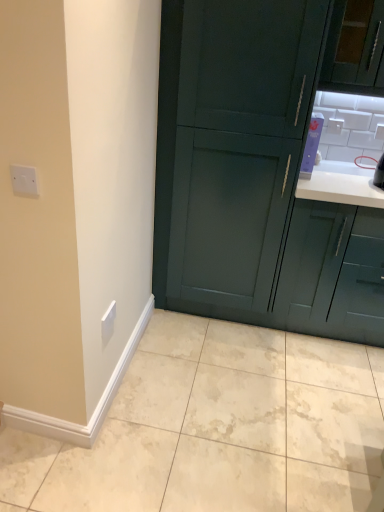
You are a GUI agent. You are given a task and a screenshot of the screen. Output one action in this format:
    pyautogui.click(x=<x>, y=<y>)
    Task: Click on the white plastic electric outlet at upper right, which appears as the 3th electric outlet when ordered from the bottom
    This screenshot has height=512, width=384.
    Given the screenshot: What is the action you would take?
    pyautogui.click(x=379, y=131)

The height and width of the screenshot is (512, 384). Describe the element at coordinates (379, 131) in the screenshot. I see `white plastic electric outlet at upper right, which ranks as the second electric outlet in top-to-bottom order` at that location.

Consider the image. How much space does dark green wood cabinet at center, which appears as the first cabinetry when viewed from the left, occupy horizontally?

It is 63.85 centimeters.

I want to click on white plastic electric outlet at upper left, which ranks as the 2th electric outlet in bottom-to-top order, so click(x=24, y=180).

Measure the distance between point (27, 195) and camera.

The depth of point (27, 195) is 4.29 feet.

Where is `white plastic electric outlet at upper right, the first electric outlet positioned from the right`? The height and width of the screenshot is (512, 384). white plastic electric outlet at upper right, the first electric outlet positioned from the right is located at coordinates (379, 131).

How much distance is there between matte teal cabinet at upper right, the second cabinetry in the left-to-right sequence, and dark green wood cabinet at center, placed as the 2th cabinetry when sorted from right to left?

They are 9.07 inches apart.

Which of these two, matte teal cabinet at upper right, the second cabinetry in the left-to-right sequence, or dark green wood cabinet at center, which appears as the first cabinetry when viewed from the left, is bigger?

Bigger between the two is dark green wood cabinet at center, which appears as the first cabinetry when viewed from the left.

Is matte teal cabinet at upper right, which ranks as the 1th cabinetry in right-to-left order, not within dark green wood cabinet at center, placed as the 2th cabinetry when sorted from right to left?

Yes, matte teal cabinet at upper right, which ranks as the 1th cabinetry in right-to-left order, is not within dark green wood cabinet at center, placed as the 2th cabinetry when sorted from right to left.

Is matte teal cabinet at upper right, the second cabinetry in the left-to-right sequence, oriented away from dark green wood cabinet at center, placed as the 2th cabinetry when sorted from right to left?

No.

Relative to matte teal cabinet at upper right, the second cabinetry in the left-to-right sequence, is white plastic electric outlet at upper left, which is counted as the 4th electric outlet, starting from the back, in front or behind?

Visually, white plastic electric outlet at upper left, which is counted as the 4th electric outlet, starting from the back, is located in front of matte teal cabinet at upper right, the second cabinetry in the left-to-right sequence.

Considering the positions of points (12, 174) and (345, 245), is point (12, 174) closer to camera compared to point (345, 245)?

Yes, point (12, 174) is closer to viewer.

Is white plastic electric outlet at upper left, acting as the 1th electric outlet starting from the front, wider than matte teal cabinet at upper right, the second cabinetry in the left-to-right sequence?

In fact, white plastic electric outlet at upper left, acting as the 1th electric outlet starting from the front, might be narrower than matte teal cabinet at upper right, the second cabinetry in the left-to-right sequence.

Is matte teal cabinet at upper right, the second cabinetry in the left-to-right sequence, looking in the opposite direction of white glossy electric outlet at upper center, which is the second electric outlet from right to left?

No, matte teal cabinet at upper right, the second cabinetry in the left-to-right sequence,'s orientation is not away from white glossy electric outlet at upper center, which is the second electric outlet from right to left.

Between matte teal cabinet at upper right, the second cabinetry in the left-to-right sequence, and white glossy electric outlet at upper center, marked as the fourth electric outlet in a bottom-to-top arrangement, which one has smaller size?

With smaller size is white glossy electric outlet at upper center, marked as the fourth electric outlet in a bottom-to-top arrangement.

Would you say matte teal cabinet at upper right, which ranks as the 1th cabinetry in right-to-left order, is outside white glossy electric outlet at upper center, the 1th electric outlet from the back?

Yes, matte teal cabinet at upper right, which ranks as the 1th cabinetry in right-to-left order, is located beyond the bounds of white glossy electric outlet at upper center, the 1th electric outlet from the back.

Considering the positions of objects matte teal cabinet at upper right, the second cabinetry in the left-to-right sequence, and white glossy electric outlet at upper center, marked as the 1th electric outlet in a top-to-bottom arrangement, in the image provided, who is in front, matte teal cabinet at upper right, the second cabinetry in the left-to-right sequence, or white glossy electric outlet at upper center, marked as the 1th electric outlet in a top-to-bottom arrangement,?

matte teal cabinet at upper right, the second cabinetry in the left-to-right sequence.

Is point (382, 134) closer to viewer compared to point (299, 206)?

No, (382, 134) is behind (299, 206).

Can you tell me how much white plastic electric outlet at upper right, which is the 3th electric outlet in front-to-back order, and matte teal cabinet at upper right, which ranks as the 1th cabinetry in right-to-left order, differ in facing direction?

1.83 degrees.

Are white plastic electric outlet at upper right, the first electric outlet positioned from the right, and matte teal cabinet at upper right, the second cabinetry in the left-to-right sequence, far apart?

No, white plastic electric outlet at upper right, the first electric outlet positioned from the right, is not far away from matte teal cabinet at upper right, the second cabinetry in the left-to-right sequence.

From the image's perspective, is white plastic electric outlet at upper right, which appears as the 4th electric outlet when viewed from the left, located beneath matte teal cabinet at upper right, the second cabinetry in the left-to-right sequence?

Incorrect, from the image's perspective, white plastic electric outlet at upper right, which appears as the 4th electric outlet when viewed from the left, is higher than matte teal cabinet at upper right, the second cabinetry in the left-to-right sequence.

Is white plastic electric outlet at upper right, which appears as the second electric outlet when viewed from the back, oriented away from white plastic electric outlet at upper left, arranged as the first electric outlet when viewed from the left?

white plastic electric outlet at upper right, which appears as the second electric outlet when viewed from the back, is not turned away from white plastic electric outlet at upper left, arranged as the first electric outlet when viewed from the left.

Is white plastic electric outlet at upper right, which is the 3th electric outlet in front-to-back order, taller or shorter than white plastic electric outlet at upper left, which is counted as the 4th electric outlet, starting from the back?

Considering their sizes, white plastic electric outlet at upper right, which is the 3th electric outlet in front-to-back order, has more height than white plastic electric outlet at upper left, which is counted as the 4th electric outlet, starting from the back.

From the image's perspective, which electric outlet is the 1st one below the white plastic electric outlet at upper right, which ranks as the second electric outlet in top-to-bottom order? Please provide its 2D coordinates.

[(24, 180)]

Is white plastic electric outlet at upper right, which ranks as the second electric outlet in top-to-bottom order, touching white plastic electric outlet at upper left, arranged as the third electric outlet when viewed from the top?

white plastic electric outlet at upper right, which ranks as the second electric outlet in top-to-bottom order, is not next to white plastic electric outlet at upper left, arranged as the third electric outlet when viewed from the top, and they're not touching.

Locate an element on the screen. ceramic tile beneath the white plastic electric outlet at lower left, acting as the fourth electric outlet starting from the top (from a real-world perspective) is located at coordinates (218, 428).

Looking at the image, does beige marble tile at lower center seem bigger or smaller compared to white plastic electric outlet at lower left, the 2th electric outlet when ordered from front to back?

Clearly, beige marble tile at lower center is larger in size than white plastic electric outlet at lower left, the 2th electric outlet when ordered from front to back.

From the image's perspective, is beige marble tile at lower center positioned above or below white plastic electric outlet at lower left, which is counted as the 1th electric outlet, starting from the bottom?

From the image's perspective, beige marble tile at lower center appears below white plastic electric outlet at lower left, which is counted as the 1th electric outlet, starting from the bottom.

From a real-world perspective, is beige marble tile at lower center positioned under white plastic electric outlet at lower left, acting as the fourth electric outlet starting from the top, based on gravity?

Yes, from a real-world perspective, beige marble tile at lower center is beneath white plastic electric outlet at lower left, acting as the fourth electric outlet starting from the top.

From the image's perspective, does matte teal cabinet at upper right, the second cabinetry in the left-to-right sequence, appear lower than white plastic electric outlet at upper right, which ranks as the second electric outlet in top-to-bottom order?

Yes.

Could you tell me if matte teal cabinet at upper right, which ranks as the 1th cabinetry in right-to-left order, is turned towards white plastic electric outlet at upper right, which appears as the 3th electric outlet when ordered from the bottom?

No.

Does matte teal cabinet at upper right, the second cabinetry in the left-to-right sequence, lie in front of white plastic electric outlet at upper right, which appears as the second electric outlet when viewed from the back?

Yes.

Considering the relative positions of matte teal cabinet at upper right, the second cabinetry in the left-to-right sequence, and white plastic electric outlet at upper right, which ranks as the second electric outlet in top-to-bottom order, in the image provided, is matte teal cabinet at upper right, the second cabinetry in the left-to-right sequence, to the left or to the right of white plastic electric outlet at upper right, which ranks as the second electric outlet in top-to-bottom order,?

matte teal cabinet at upper right, the second cabinetry in the left-to-right sequence, is to the left of white plastic electric outlet at upper right, which ranks as the second electric outlet in top-to-bottom order.

Identify the location of cabinetry to the left of matte teal cabinet at upper right, the second cabinetry in the left-to-right sequence. This screenshot has width=384, height=512. (260, 170).

Starting from the white plastic electric outlet at upper left, which is counted as the 4th electric outlet, starting from the back, which cabinetry is the 2nd one behind? Please provide its 2D coordinates.

[(333, 272)]

Based on their spatial positions, is white plastic electric outlet at lower left, acting as the fourth electric outlet starting from the top, or white plastic electric outlet at upper left, arranged as the third electric outlet when viewed from the top, closer to matte teal cabinet at upper right, which ranks as the 1th cabinetry in right-to-left order?

white plastic electric outlet at lower left, acting as the fourth electric outlet starting from the top, lies closer to matte teal cabinet at upper right, which ranks as the 1th cabinetry in right-to-left order, than the other object.

Which object lies further to the anchor point beige marble tile at lower center, matte teal cabinet at upper right, the second cabinetry in the left-to-right sequence, or white plastic electric outlet at lower left, acting as the third electric outlet starting from the back?

white plastic electric outlet at lower left, acting as the third electric outlet starting from the back, is further to beige marble tile at lower center.

When comparing their distances from matte teal cabinet at upper right, the second cabinetry in the left-to-right sequence, does beige marble tile at lower center or white plastic electric outlet at lower left, acting as the third electric outlet starting from the back, seem closer?

beige marble tile at lower center.

From the image, which object appears to be nearer to white plastic electric outlet at lower left, acting as the fourth electric outlet starting from the top, white glossy electric outlet at upper center, which is the second electric outlet from right to left, or dark green wood cabinet at center, which appears as the first cabinetry when viewed from the left?

dark green wood cabinet at center, which appears as the first cabinetry when viewed from the left, is closer to white plastic electric outlet at lower left, acting as the fourth electric outlet starting from the top.

Based on their spatial positions, is white glossy electric outlet at upper center, the fourth electric outlet from the front, or beige marble tile at lower center closer to white plastic electric outlet at lower left, the second electric outlet viewed from the left?

beige marble tile at lower center is closer to white plastic electric outlet at lower left, the second electric outlet viewed from the left.

When comparing their distances from white plastic electric outlet at upper right, which ranks as the second electric outlet in top-to-bottom order, does matte teal cabinet at upper right, the second cabinetry in the left-to-right sequence, or dark green wood cabinet at center, placed as the 2th cabinetry when sorted from right to left, seem closer?

Among the two, matte teal cabinet at upper right, the second cabinetry in the left-to-right sequence, is located nearer to white plastic electric outlet at upper right, which ranks as the second electric outlet in top-to-bottom order.

Looking at the image, which one is located further to matte teal cabinet at upper right, the second cabinetry in the left-to-right sequence, beige marble tile at lower center or white plastic electric outlet at upper left, acting as the 1th electric outlet starting from the front?

white plastic electric outlet at upper left, acting as the 1th electric outlet starting from the front, is positioned further to the anchor matte teal cabinet at upper right, the second cabinetry in the left-to-right sequence.

Which object lies nearer to the anchor point white plastic electric outlet at upper right, which appears as the second electric outlet when viewed from the back, matte teal cabinet at upper right, which ranks as the 1th cabinetry in right-to-left order, or white plastic electric outlet at lower left, the second electric outlet viewed from the left?

matte teal cabinet at upper right, which ranks as the 1th cabinetry in right-to-left order.

Find the location of a particular element. Image resolution: width=384 pixels, height=512 pixels. electric outlet between white plastic electric outlet at upper left, acting as the 1th electric outlet starting from the front, and white glossy electric outlet at upper center, the 1th electric outlet from the back is located at coordinates (108, 322).

Find the location of a particular element. cabinetry between dark green wood cabinet at center, which appears as the first cabinetry when viewed from the left, and white plastic electric outlet at upper right, which ranks as the second electric outlet in top-to-bottom order is located at coordinates (333, 272).

Identify the location of cabinetry between white plastic electric outlet at upper left, arranged as the first electric outlet when viewed from the left, and white glossy electric outlet at upper center, the 1th electric outlet from the back. (260, 170).

I want to click on ceramic tile between white plastic electric outlet at lower left, acting as the third electric outlet starting from the back, and matte teal cabinet at upper right, the second cabinetry in the left-to-right sequence, so click(x=218, y=428).